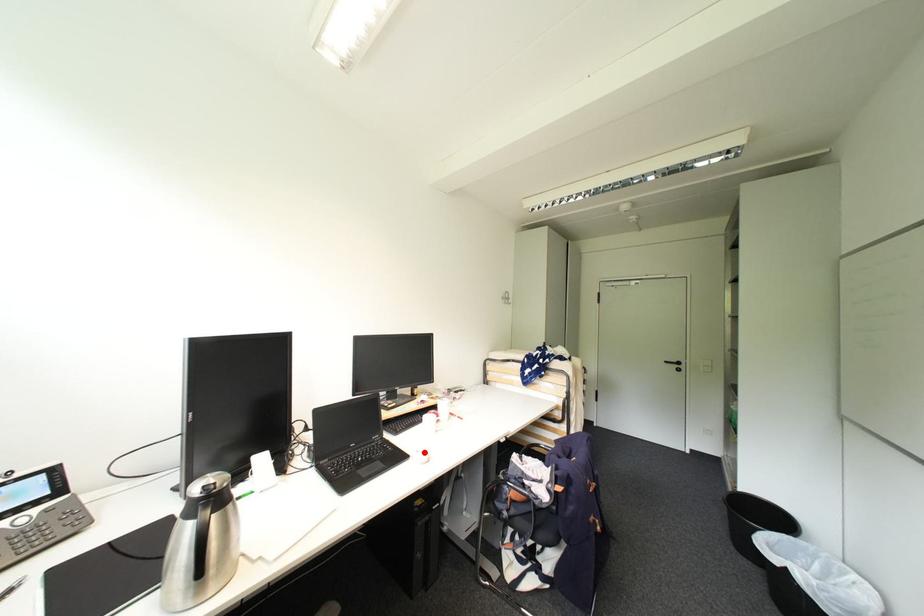
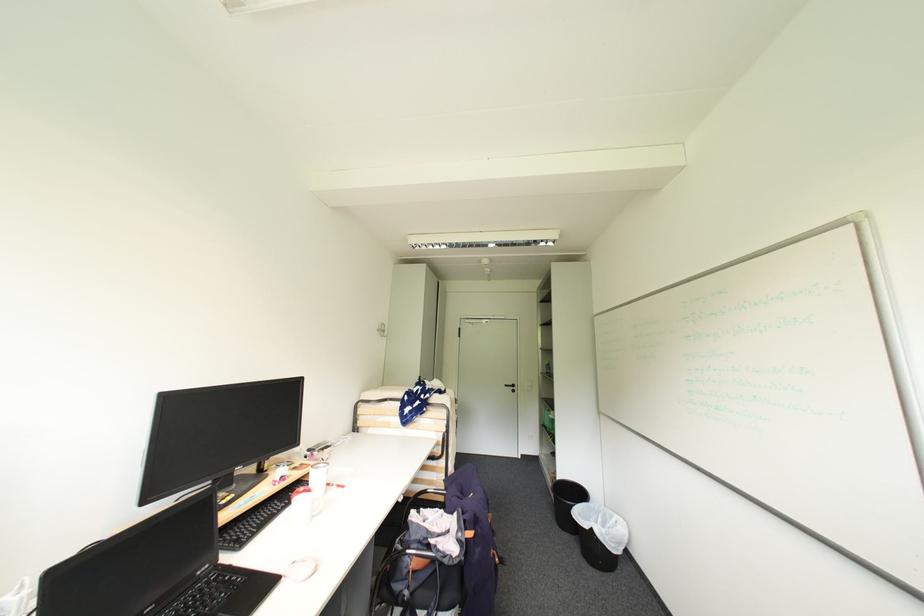
Where in the second image is the point corresponding to the highlighted location from the first image?

(300, 564)